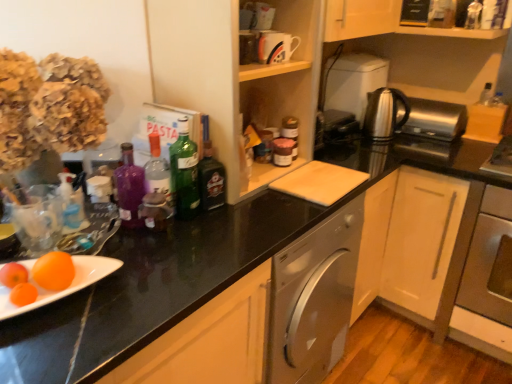
Find the location of a particular element. The image size is (512, 384). vacant region to the right of dark green glass bottle at center, arranged as the 1th bottle when viewed from the right is located at coordinates (258, 213).